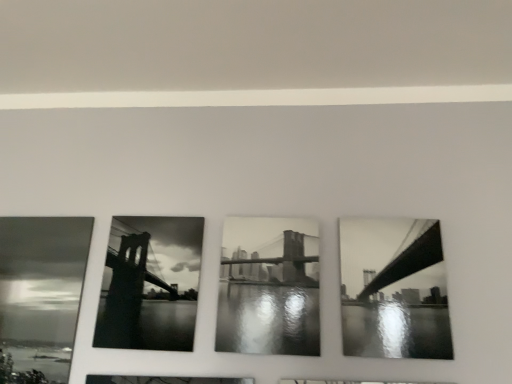
Question: Is black glossy bridge at right, positioned as the 1th picture frame in right-to-left order, not within black and white photograph of bridge at center, which appears as the second picture frame when viewed from the left?

Choices:
 (A) no
 (B) yes

Answer: (B)

Question: From the image's perspective, is black glossy bridge at right, positioned as the 1th picture frame in right-to-left order, above black and white photograph of bridge at center, which appears as the second picture frame when viewed from the left?

Choices:
 (A) yes
 (B) no

Answer: (A)

Question: Is black glossy bridge at right, which is the third picture frame in left-to-right order, closer to camera compared to black and white photograph of bridge at center, placed as the second picture frame when sorted from right to left?

Choices:
 (A) no
 (B) yes

Answer: (B)

Question: Is black glossy bridge at right, which is the third picture frame in left-to-right order, oriented towards black and white photograph of bridge at center, placed as the second picture frame when sorted from right to left?

Choices:
 (A) yes
 (B) no

Answer: (B)

Question: Considering the relative positions of black glossy bridge at right, positioned as the 1th picture frame in right-to-left order, and black and white photograph of bridge at center, placed as the second picture frame when sorted from right to left, in the image provided, is black glossy bridge at right, positioned as the 1th picture frame in right-to-left order, to the right of black and white photograph of bridge at center, placed as the second picture frame when sorted from right to left, from the viewer's perspective?

Choices:
 (A) yes
 (B) no

Answer: (A)

Question: In the image, is black and white photograph of bridge at center, which appears as the second picture frame when viewed from the left, positioned in front of or behind black glossy bridge at right, which is the third picture frame in left-to-right order?

Choices:
 (A) front
 (B) behind

Answer: (B)

Question: Choose the correct answer: Is black and white photograph of bridge at center, placed as the second picture frame when sorted from right to left, inside black glossy bridge at right, positioned as the 1th picture frame in right-to-left order, or outside it?

Choices:
 (A) outside
 (B) inside

Answer: (A)

Question: From a real-world perspective, relative to black glossy bridge at right, which is the third picture frame in left-to-right order, is black and white photograph of bridge at center, which appears as the second picture frame when viewed from the left, vertically above or below?

Choices:
 (A) above
 (B) below

Answer: (B)

Question: Is point (228, 296) closer or farther from the camera than point (402, 274)?

Choices:
 (A) closer
 (B) farther

Answer: (B)

Question: Is black glossy photo frame at center, placed as the 3th picture frame when sorted from right to left, taller or shorter than black glossy bridge at right, positioned as the 1th picture frame in right-to-left order?

Choices:
 (A) tall
 (B) short

Answer: (A)

Question: Considering the positions of black glossy photo frame at center, arranged as the 1th picture frame when viewed from the left, and black glossy bridge at right, which is the third picture frame in left-to-right order, in the image, is black glossy photo frame at center, arranged as the 1th picture frame when viewed from the left, bigger or smaller than black glossy bridge at right, which is the third picture frame in left-to-right order,?

Choices:
 (A) small
 (B) big

Answer: (B)

Question: Is black glossy photo frame at center, arranged as the 1th picture frame when viewed from the left, wider or thinner than black glossy bridge at right, which is the third picture frame in left-to-right order?

Choices:
 (A) wide
 (B) thin

Answer: (B)

Question: Considering the positions of point (188, 281) and point (354, 344), is point (188, 281) closer or farther from the camera than point (354, 344)?

Choices:
 (A) farther
 (B) closer

Answer: (A)

Question: In terms of height, does black glossy bridge at right, which is the third picture frame in left-to-right order, look taller or shorter compared to black glossy photo frame at center, placed as the 3th picture frame when sorted from right to left?

Choices:
 (A) tall
 (B) short

Answer: (B)

Question: Based on their positions, is black glossy bridge at right, positioned as the 1th picture frame in right-to-left order, located to the left or right of black glossy photo frame at center, placed as the 3th picture frame when sorted from right to left?

Choices:
 (A) right
 (B) left

Answer: (A)